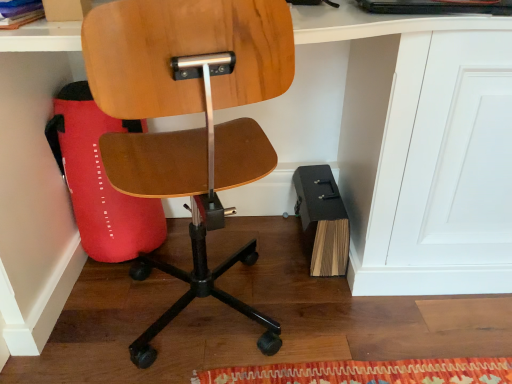
What are the coordinates of `vacant area to the right of wooden chair at center` in the screenshot? It's located at (348, 322).